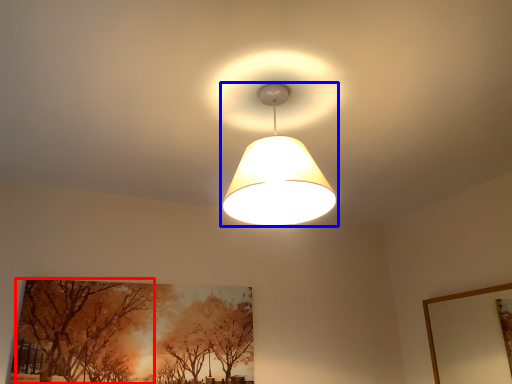
Question: Which object is closer to the camera taking this photo, tree (highlighted by a red box) or lamp (highlighted by a blue box)?

Choices:
 (A) tree
 (B) lamp

Answer: (B)